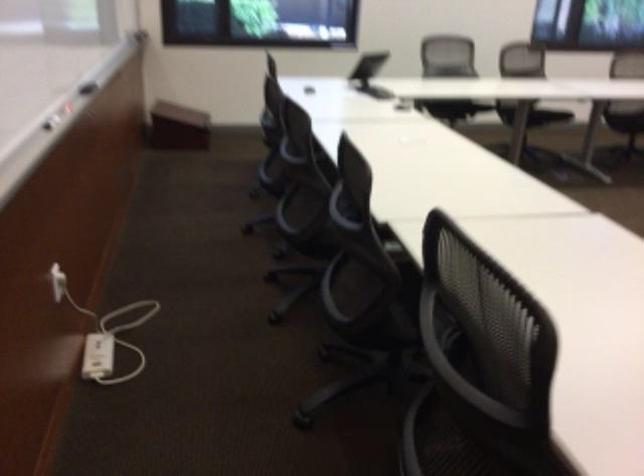
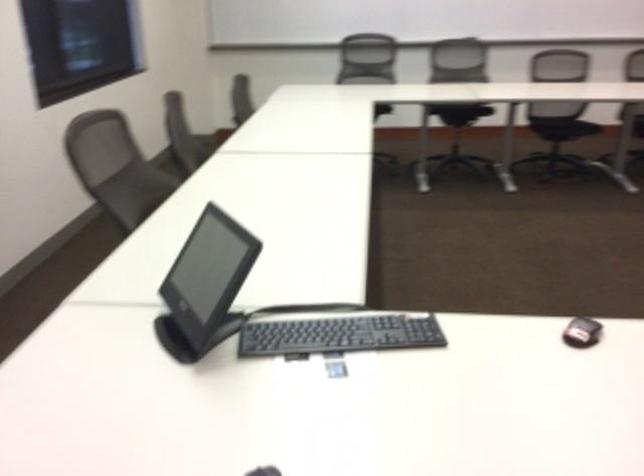
Question: In a continuous first-person perspective shot, in which direction is the camera moving?

Choices:
 (A) Left
 (B) Right
 (C) Forward
 (D) Backward

Answer: (D)